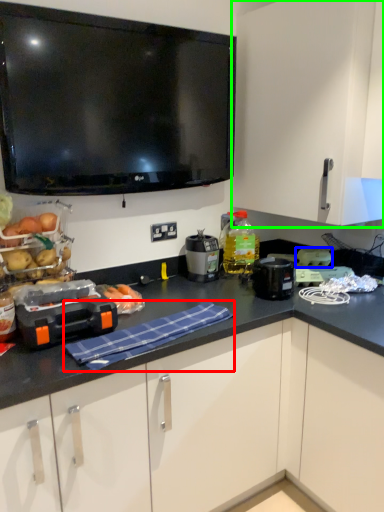
Question: Which is nearer to the cloth (highlighted by a red box)? appliance (highlighted by a blue box) or cabinetry (highlighted by a green box).

Choices:
 (A) appliance
 (B) cabinetry

Answer: (A)